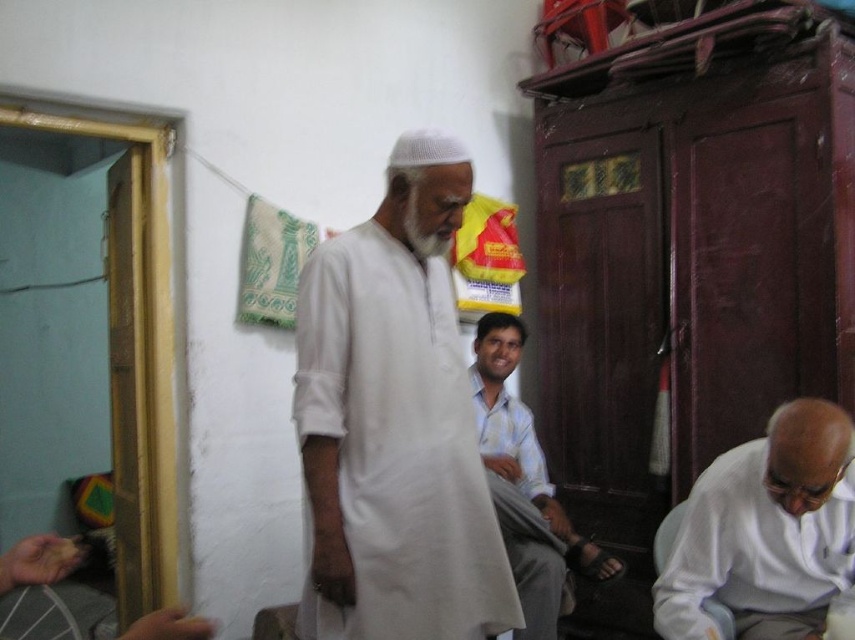
Between point (373, 572) and point (741, 499), which one is positioned in front?

Positioned in front is point (373, 572).

Does white cotton robe at center have a lesser height compared to white matte shirt at lower right?

Incorrect, white cotton robe at center's height does not fall short of white matte shirt at lower right's.

This screenshot has height=640, width=855. In order to click on white cotton robe at center in this screenshot , I will do `click(396, 448)`.

Is white cotton robe at center above light blue cotton shirt at center?

Indeed, white cotton robe at center is positioned over light blue cotton shirt at center.

How distant is white cotton robe at center from light blue cotton shirt at center?

The distance of white cotton robe at center from light blue cotton shirt at center is 30.68 inches.

You are a GUI agent. You are given a task and a screenshot of the screen. Output one action in this format:
    pyautogui.click(x=<x>, y=<y>)
    Task: Click on the white cotton robe at center
    This screenshot has width=855, height=640.
    Given the screenshot: What is the action you would take?
    pyautogui.click(x=396, y=448)

Does point (815, 529) come behind point (528, 620)?

That is False.

Which is below, white matte shirt at lower right or light blue cotton shirt at center?

Positioned lower is white matte shirt at lower right.

Describe the element at coordinates (765, 531) in the screenshot. I see `white matte shirt at lower right` at that location.

Identify the location of white matte shirt at lower right. (765, 531).